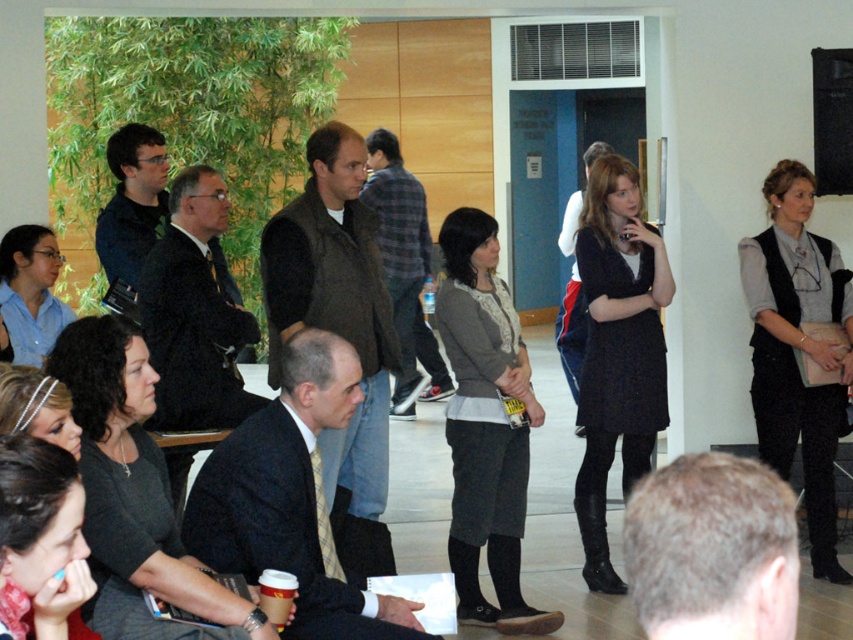
This screenshot has width=853, height=640. What do you see at coordinates (335, 305) in the screenshot?
I see `dark brown vest at center` at bounding box center [335, 305].

Does dark brown vest at center come in front of dark woolen dress at center?

Yes, dark brown vest at center is in front of dark woolen dress at center.

Does point (292, 252) lie in front of point (608, 164)?

Yes, it is in front of point (608, 164).

Locate an element on the screen. dark brown vest at center is located at coordinates (335, 305).

Can you confirm if dark brown leather jacket at center is positioned below matte black jacket at upper left?

Correct, dark brown leather jacket at center is located below matte black jacket at upper left.

Does dark brown leather jacket at center come in front of matte black jacket at upper left?

No, it is not.

Is point (368, 163) positioned in front of point (148, 125)?

No, it is not.

Identify the location of dark brown leather jacket at center. This screenshot has width=853, height=640. pos(404,268).

From the picture: Can you confirm if dark brown vest at center is bigger than gray wool vest at upper right?

Correct, dark brown vest at center is larger in size than gray wool vest at upper right.

Between point (384, 353) and point (807, 474), which one is positioned in front?

Point (384, 353) is in front.

This screenshot has height=640, width=853. What are the coordinates of `dark brown vest at center` in the screenshot? It's located at pos(335,305).